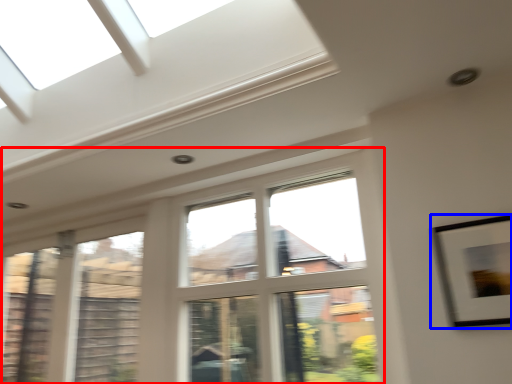
Question: Which object is closer to the camera taking this photo, window (highlighted by a red box) or picture frame (highlighted by a blue box)?

Choices:
 (A) window
 (B) picture frame

Answer: (B)